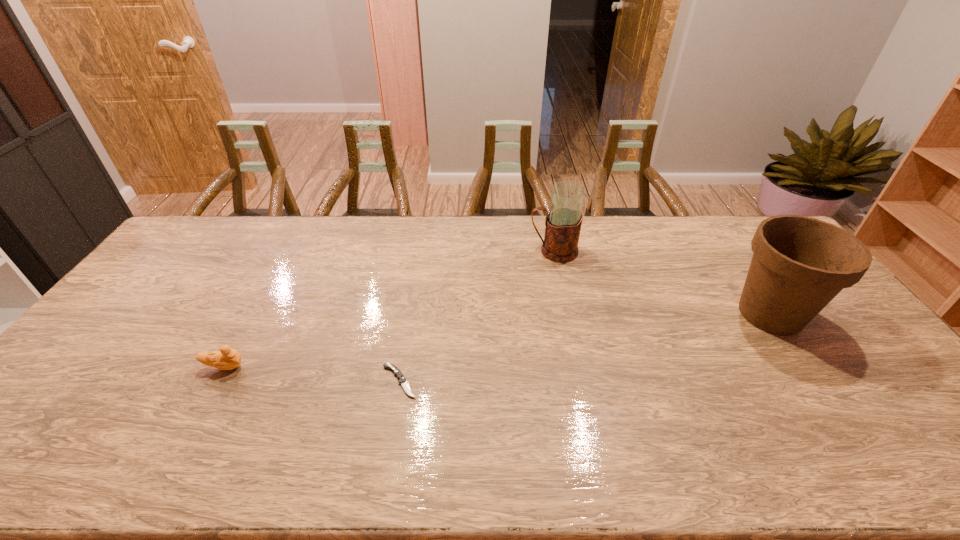
Find the location of `blank space located 0.300m with the handle on the side of the pitcher`. blank space located 0.300m with the handle on the side of the pitcher is located at coordinates (443, 251).

At what (x,y) coordinates should I click in order to perform the action: click on vacant space located with the handle on the side of the pitcher. Please return your answer as a coordinate pair (x, y). Looking at the image, I should click on coord(486,251).

The width and height of the screenshot is (960, 540). What are the coordinates of `vacant region located on the face of the leftmost object` in the screenshot? It's located at (336, 367).

Where is `free space located on the right of the pocketknife`? free space located on the right of the pocketknife is located at coordinates (469, 381).

Find the location of `object that is positioned at the far edge`. object that is positioned at the far edge is located at coordinates (563, 223).

I want to click on object present at the right edge, so click(799, 264).

In the image, there is a desktop. Where is `free space at the far edge`? Image resolution: width=960 pixels, height=540 pixels. free space at the far edge is located at coordinates (270, 240).

You are a GUI agent. You are given a task and a screenshot of the screen. Output one action in this format:
    pyautogui.click(x=<x>, y=<y>)
    Task: Click on the vacant space at the near edge of the desktop
    Image resolution: width=960 pixels, height=540 pixels.
    Given the screenshot: What is the action you would take?
    pyautogui.click(x=178, y=465)

In the image, there is a desktop. In order to click on free region at the left edge in this screenshot , I will do `click(132, 311)`.

Find the location of `blank space at the right edge of the desktop`. blank space at the right edge of the desktop is located at coordinates (830, 315).